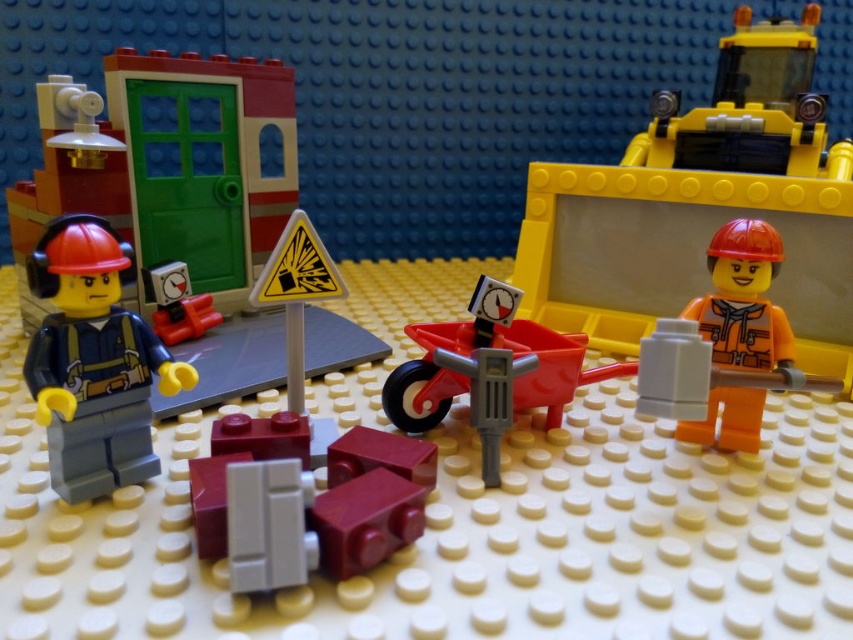
Question: Is matte black construction worker at left further to the viewer compared to matte red clock at left?

Choices:
 (A) no
 (B) yes

Answer: (A)

Question: Which point is closer to the camera?

Choices:
 (A) (183, 282)
 (B) (450, 369)
 (C) (54, 470)
 (D) (746, 316)

Answer: (C)

Question: Is matte black construction worker at left positioned before smooth red wheelbarrow at center?

Choices:
 (A) yes
 (B) no

Answer: (A)

Question: Considering the real-world distances, which object is farthest from the matte red clock at left?

Choices:
 (A) orange matte construction worker at right
 (B) matte black construction worker at left

Answer: (A)

Question: Which point is closer to the camera taking this photo?

Choices:
 (A) (701, 314)
 (B) (437, 388)
 (C) (180, 300)
 (D) (137, 392)

Answer: (D)

Question: In this image, where is matte black construction worker at left located relative to matte red clock at left?

Choices:
 (A) below
 (B) above

Answer: (A)